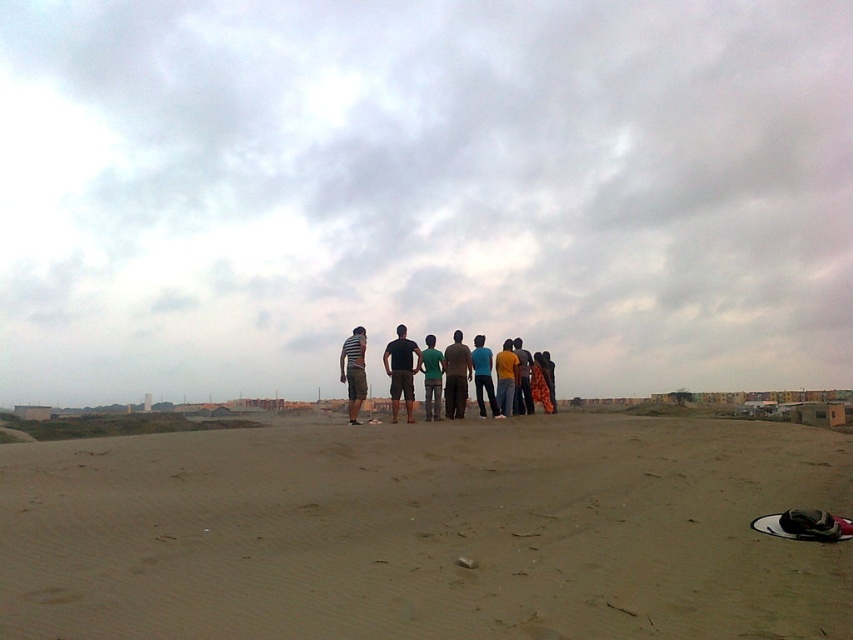
Which is more to the left, green matte shirt at center or yellow cotton shirt at center?

green matte shirt at center is more to the left.

Is green matte shirt at center wider than yellow cotton shirt at center?

No, green matte shirt at center is not wider than yellow cotton shirt at center.

Where is `green matte shirt at center`? green matte shirt at center is located at coordinates (431, 378).

Find the location of a particular element. The height and width of the screenshot is (640, 853). green matte shirt at center is located at coordinates (431, 378).

Identify the location of smooth sand at center. This screenshot has width=853, height=640. (426, 532).

Is smooth sand at center above dark blue t-shirt at center?

No.

Image resolution: width=853 pixels, height=640 pixels. What do you see at coordinates (426, 532) in the screenshot?
I see `smooth sand at center` at bounding box center [426, 532].

What are the coordinates of `smooth sand at center` in the screenshot? It's located at [426, 532].

Is dark gray fabric pants at center bigger than striped fabric shirt at center?

Actually, dark gray fabric pants at center might be smaller than striped fabric shirt at center.

Is dark gray fabric pants at center thinner than striped fabric shirt at center?

No.

Who is more distant from viewer, (448, 384) or (352, 353)?

Positioned behind is point (448, 384).

In order to click on dark gray fabric pants at center in this screenshot , I will do `click(456, 376)`.